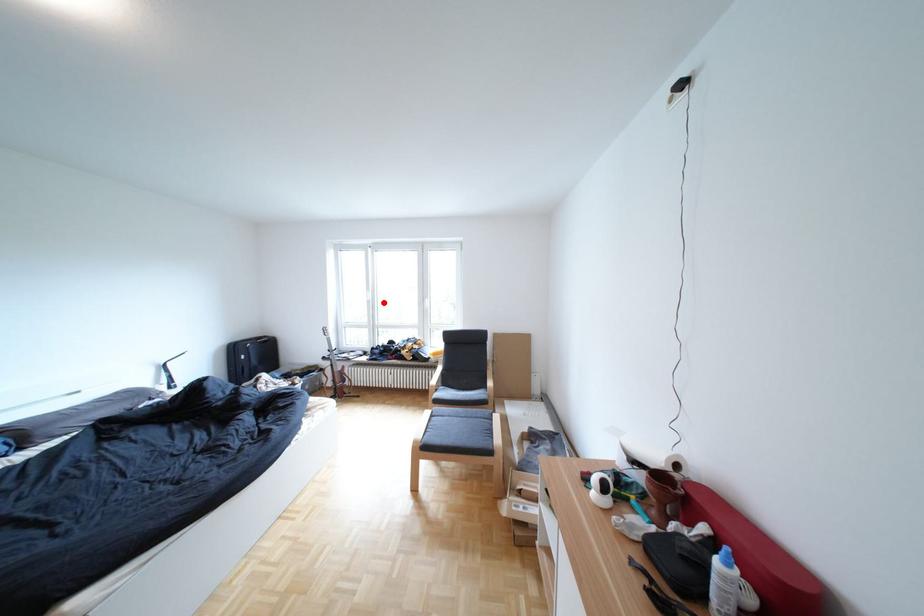
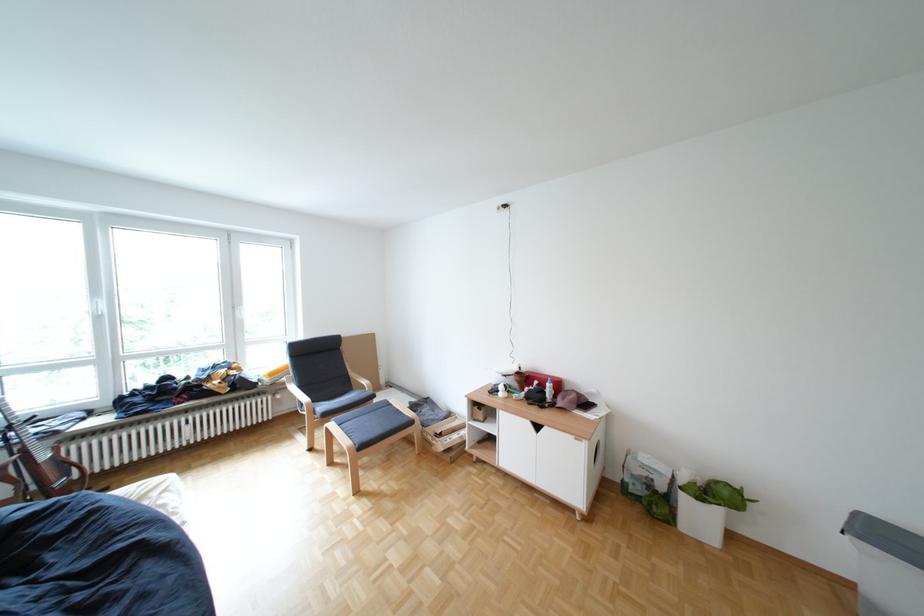
Question: I am providing you with two images of the same scene from different viewpoints. Image1 has a red point marked. In image2, the corresponding 3D location appears at what relative position? Reply with the corresponding letter.

Choices:
 (A) Closer
 (B) Farther

Answer: (A)